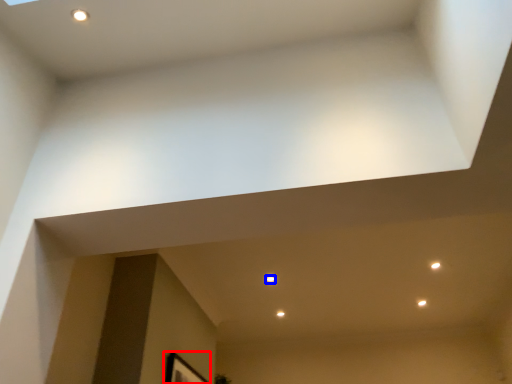
Question: Which of the following is the closest to the observer, picture frame (highlighted by a red box) or light (highlighted by a blue box)?

Choices:
 (A) picture frame
 (B) light

Answer: (A)